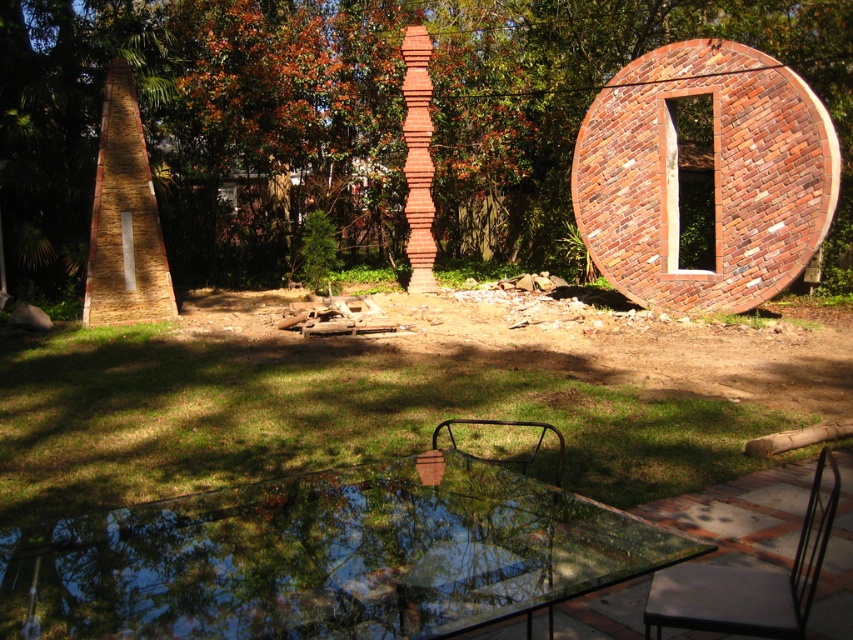
You are standing in the garden and want to take a photo of the green leafy tree at upper center. You notice a point marked at coordinates [349,120]. Is this point the correct location to stand to capture the tree in your photo?

Yes, the green leafy tree at upper center is located at point [349,120], so standing there would allow you to capture the tree in your photo.

You are a person who is 1.8 meters tall. You want to sit on the metallic black chair at lower right and the black metal chair at lower center. Can you comfortably sit on both chairs without needing to move more than 2 meters between them?

The metallic black chair at lower right and the black metal chair at lower center are 2.10 meters apart from each other. Since you need to move no more than 2 meters between them, the distance is slightly over the limit, so you would need to move a bit more than 2 meters to reach from one to the other.